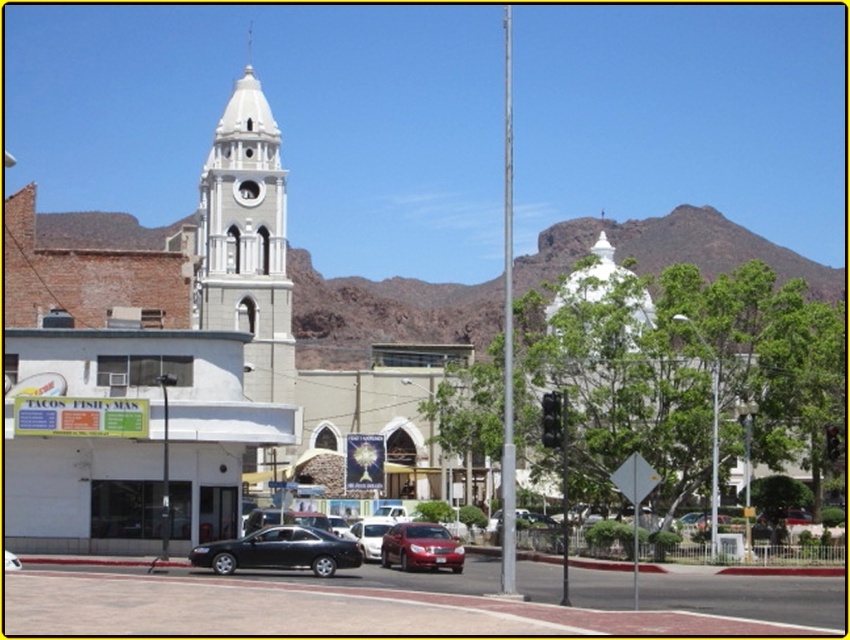
You are standing on the sidewalk with a red curb. You see a point marked at coordinate [279,552]. What object is located at that point?

The point at coordinate [279,552] marks the location of the matte black sedan at center.

You are a delivery person needing to park your vehicle in a space that can accommodate larger vehicles. Based on the scene, which vehicle between the matte black sedan at center and the metallic silver sedan at center would require a bigger parking space?

The matte black sedan at center requires a bigger parking space because it has a larger size compared to the metallic silver sedan at center.

You are a delivery driver who needs to park your van, which is 5 meters long, between the shiny red sedan at center and the metallic silver sedan at center. Based on the scene, can you fit your van there?

The distance between the shiny red sedan at center and the metallic silver sedan at center is 4.68 meters. Since your van is 5 meters long, it is slightly too long to fit in the space between them.